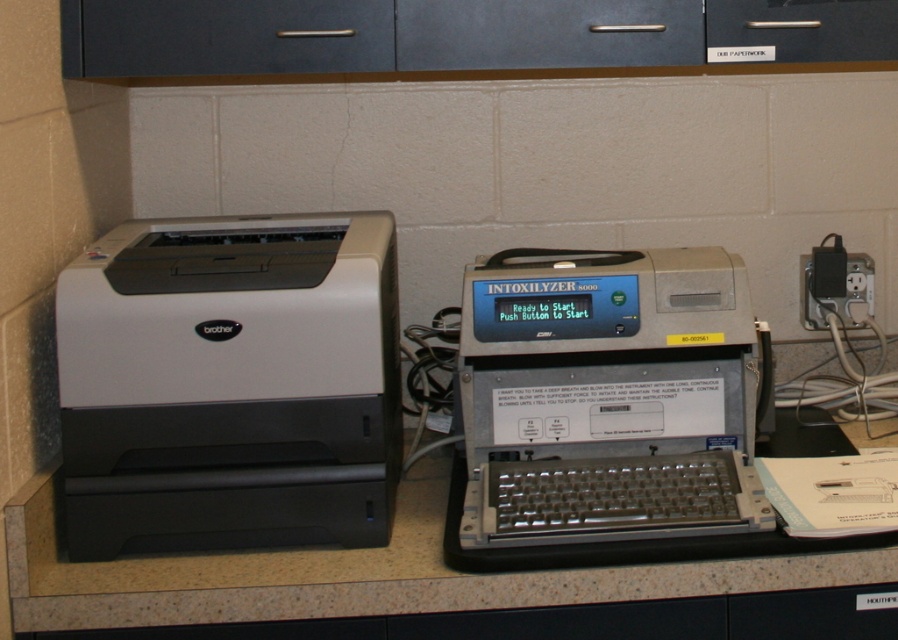
Question: Among these objects, which one is nearest to the camera?

Choices:
 (A) gray plastic intoxilyzer at center
 (B) brushed metal drawer at upper center
 (C) matte black printer at left

Answer: (A)

Question: Is matte black printer at left smaller than granite countertop at center?

Choices:
 (A) yes
 (B) no

Answer: (A)

Question: Can you confirm if gray plastic intoxilyzer at center is thinner than granite countertop at center?

Choices:
 (A) no
 (B) yes

Answer: (B)

Question: Is dark gray matte drawer at upper center wider than brushed metal drawer at upper center?

Choices:
 (A) no
 (B) yes

Answer: (B)

Question: Which point appears closest to the camera in this image?

Choices:
 (A) (190, 32)
 (B) (555, 20)

Answer: (A)

Question: Which object appears closest to the camera in this image?

Choices:
 (A) dark gray matte drawer at upper center
 (B) brushed metal drawer at upper center

Answer: (A)